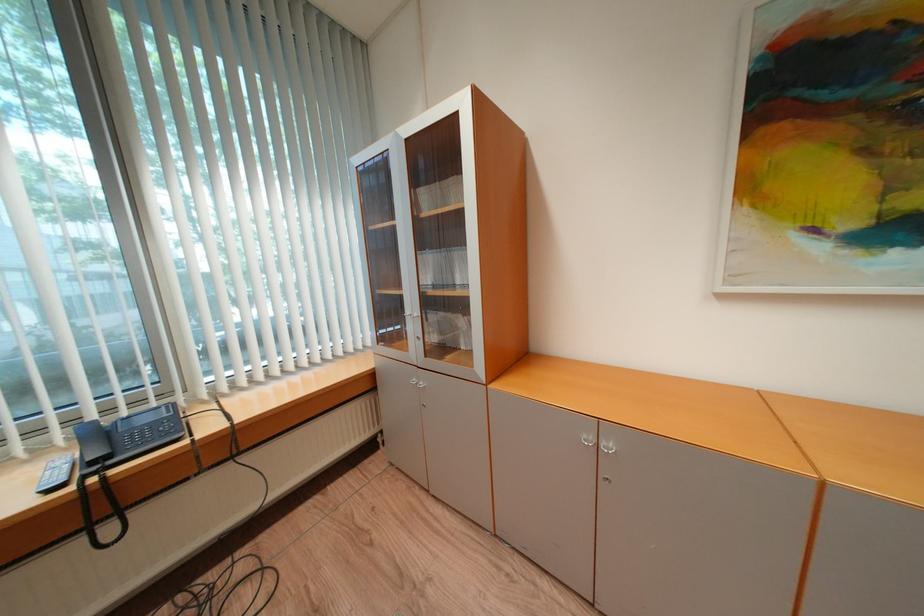
Locate an element on the screen. This screenshot has width=924, height=616. clear cabinet handle is located at coordinates (408, 315).